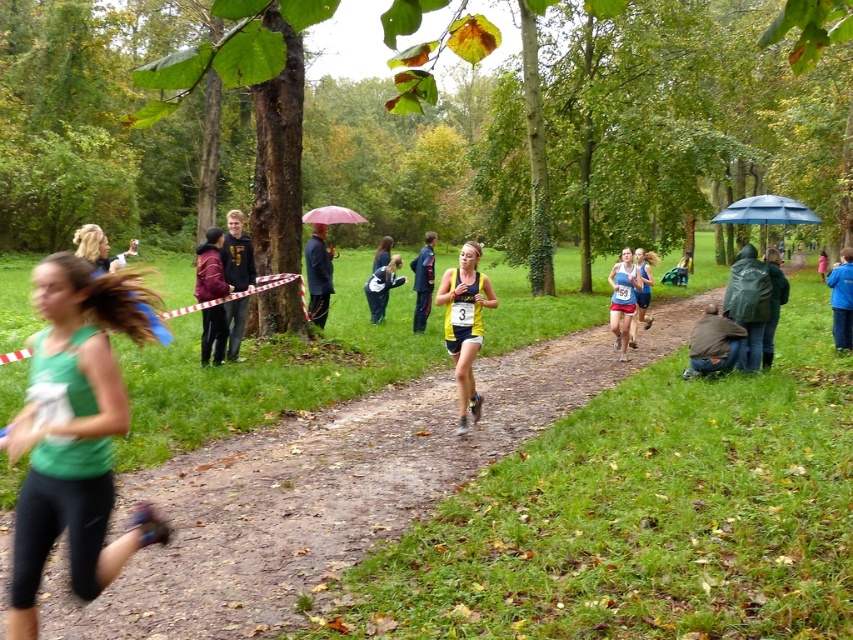
Between point (734, 365) and point (809, 216), which one is positioned in front?

Point (734, 365) is more forward.

Can you confirm if brown leather jacket at lower right is positioned below blue matte umbrella at upper right?

Yes, brown leather jacket at lower right is below blue matte umbrella at upper right.

I want to click on brown leather jacket at lower right, so click(714, 344).

At what (x,y) coordinates should I click in order to perform the action: click on brown leather jacket at lower right. Please return your answer as a coordinate pair (x, y). This screenshot has width=853, height=640. Looking at the image, I should click on (714, 344).

Does matte green tank top at center lie in front of blue matte umbrella at upper right?

Yes, matte green tank top at center is closer to the viewer.

Looking at this image, between matte green tank top at center and blue matte umbrella at upper right, which one appears on the left side from the viewer's perspective?

matte green tank top at center is more to the left.

Which is behind, point (224, 625) or point (799, 221)?

The point (799, 221) is behind.

The height and width of the screenshot is (640, 853). What are the coordinates of `matte green tank top at center` in the screenshot? It's located at (329, 488).

Who is positioned more to the right, brown leather jacket at lower right or pink fabric umbrella at center?

brown leather jacket at lower right is more to the right.

How much distance is there between brown leather jacket at lower right and pink fabric umbrella at center?

A distance of 6.65 meters exists between brown leather jacket at lower right and pink fabric umbrella at center.

Which is behind, point (728, 326) or point (329, 241)?

Point (329, 241)

Image resolution: width=853 pixels, height=640 pixels. Identify the location of brown leather jacket at lower right. (714, 344).